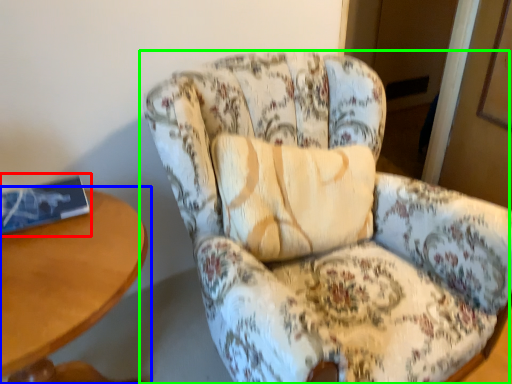
Question: Based on their relative distances, which object is farther from book (highlighted by a red box)? Choose from table (highlighted by a blue box) and chair (highlighted by a green box).

Choices:
 (A) table
 (B) chair

Answer: (B)